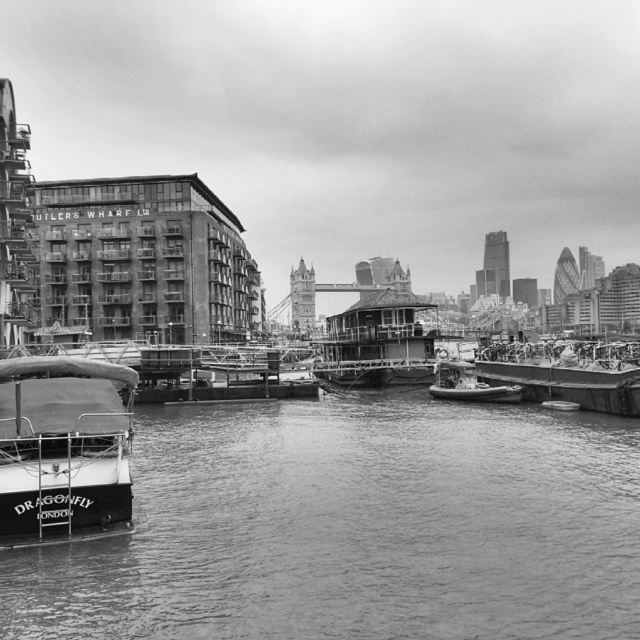
Is smooth water at lower left smaller than metallic gray boat at right?

Incorrect, smooth water at lower left is not smaller in size than metallic gray boat at right.

The width and height of the screenshot is (640, 640). What do you see at coordinates (353, 529) in the screenshot?
I see `smooth water at lower left` at bounding box center [353, 529].

This screenshot has width=640, height=640. I want to click on smooth water at lower left, so click(x=353, y=529).

Is smooth water at lower left to the right of wooden deck houseboat at center from the viewer's perspective?

In fact, smooth water at lower left is to the left of wooden deck houseboat at center.

Based on the photo, is smooth water at lower left to the left of wooden deck houseboat at center from the viewer's perspective?

Correct, you'll find smooth water at lower left to the left of wooden deck houseboat at center.

Between point (83, 628) and point (410, 310), which one is positioned behind?

Point (410, 310)

Identify the location of smooth water at lower left. (353, 529).

Does white matte boat at lower left have a lesser height compared to metallic gray boat at right?

Incorrect, white matte boat at lower left's height does not fall short of metallic gray boat at right's.

Locate an element on the screen. This screenshot has width=640, height=640. white matte boat at lower left is located at coordinates (64, 449).

Locate an element on the screen. The image size is (640, 640). white matte boat at lower left is located at coordinates (64, 449).